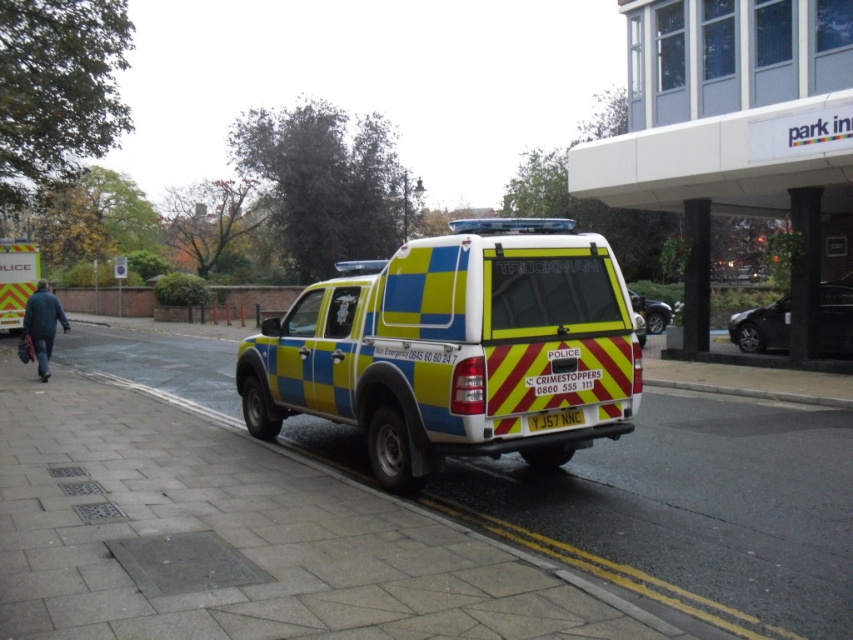
Between paved concrete sidewalk at center and yellow and blue checkered truck at center, which one appears on the right side from the viewer's perspective?

paved concrete sidewalk at center

The image size is (853, 640). What do you see at coordinates (692, 512) in the screenshot?
I see `paved concrete sidewalk at center` at bounding box center [692, 512].

Is point (283, 432) positioned before point (495, 432)?

No, it is behind (495, 432).

The image size is (853, 640). In order to click on paved concrete sidewalk at center in this screenshot , I will do `click(692, 512)`.

Looking at this image, which is below, yellow and blue checkered truck at center or yellow reflective plate at center?

yellow reflective plate at center is below.

Is yellow and blue checkered truck at center above yellow reflective plate at center?

Indeed, yellow and blue checkered truck at center is positioned over yellow reflective plate at center.

Locate an element on the screen. This screenshot has height=640, width=853. yellow and blue checkered truck at center is located at coordinates (456, 348).

Does yellow and blue checkered truck at center lie in front of metallic silver car at right?

Yes, yellow and blue checkered truck at center is in front of metallic silver car at right.

Does yellow and blue checkered truck at center have a greater height compared to metallic silver car at right?

Yes.

Which is in front, point (392, 305) or point (733, 321)?

Positioned in front is point (392, 305).

You are a GUI agent. You are given a task and a screenshot of the screen. Output one action in this format:
    pyautogui.click(x=<x>, y=<y>)
    Task: Click on the yellow and blue checkered truck at center
    The width and height of the screenshot is (853, 640).
    Given the screenshot: What is the action you would take?
    (x=456, y=348)